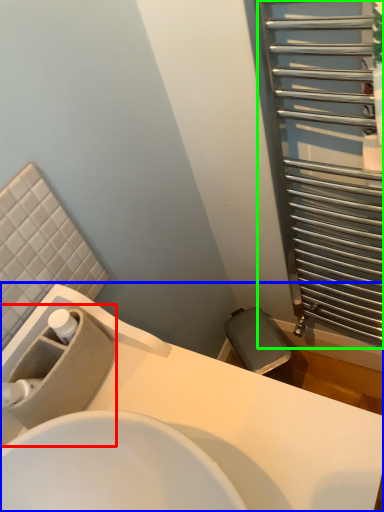
Question: Based on their relative distances, which object is nearer to sink (highlighted by a red box)? Choose from sink (highlighted by a blue box) and screen door (highlighted by a green box).

Choices:
 (A) sink
 (B) screen door

Answer: (A)